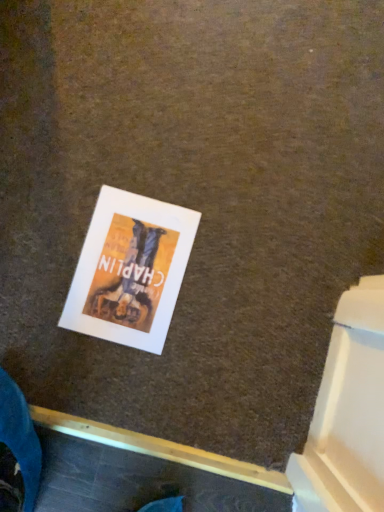
Locate an element on the screen. free region under matte paper poster at center (from a real-world perspective) is located at coordinates (127, 268).